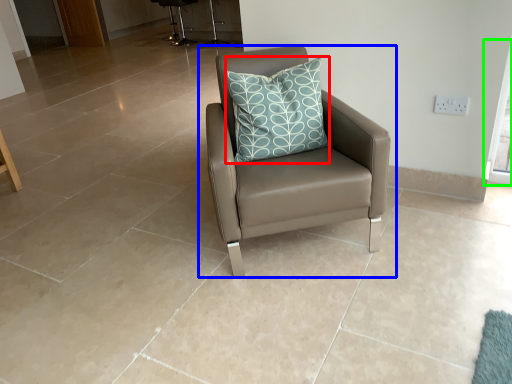
Question: Based on their relative distances, which object is nearer to pillow (highlighted by a red box)? Choose from chair (highlighted by a blue box) and window screen (highlighted by a green box).

Choices:
 (A) chair
 (B) window screen

Answer: (A)